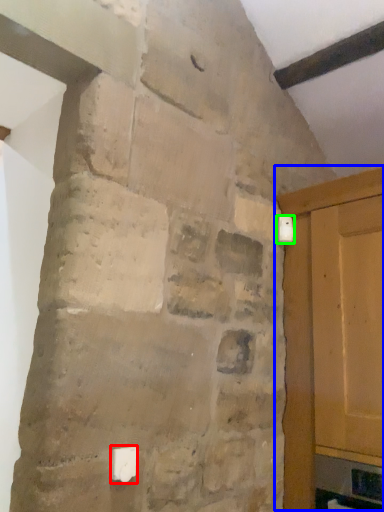
Question: Which object is positioned closest to light switch (highlighted by a red box)? Select from door (highlighted by a blue box) and light switch (highlighted by a green box).

Choices:
 (A) door
 (B) light switch

Answer: (A)